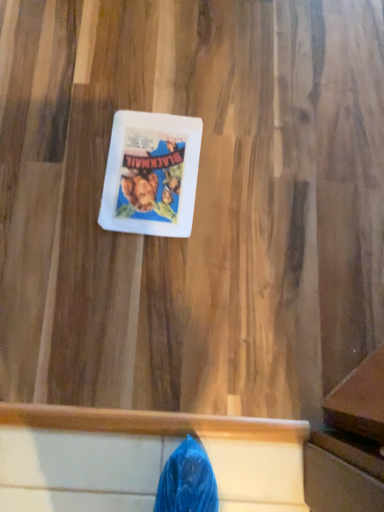
The height and width of the screenshot is (512, 384). What are the coordinates of `white matte comic book at center` in the screenshot? It's located at (151, 174).

Image resolution: width=384 pixels, height=512 pixels. Describe the element at coordinates (151, 174) in the screenshot. I see `white matte comic book at center` at that location.

Where is `white matte comic book at center`? This screenshot has width=384, height=512. white matte comic book at center is located at coordinates (151, 174).